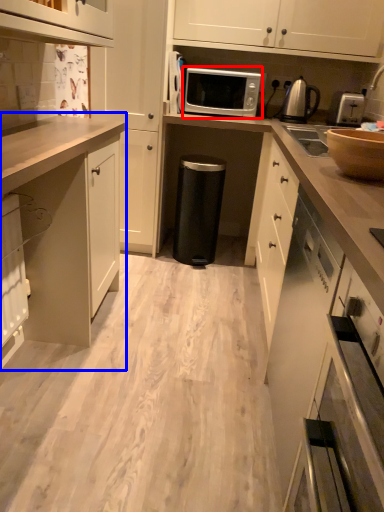
Question: Which object appears closest to the camera in this image, microwave oven (highlighted by a red box) or cabinetry (highlighted by a blue box)?

Choices:
 (A) microwave oven
 (B) cabinetry

Answer: (B)